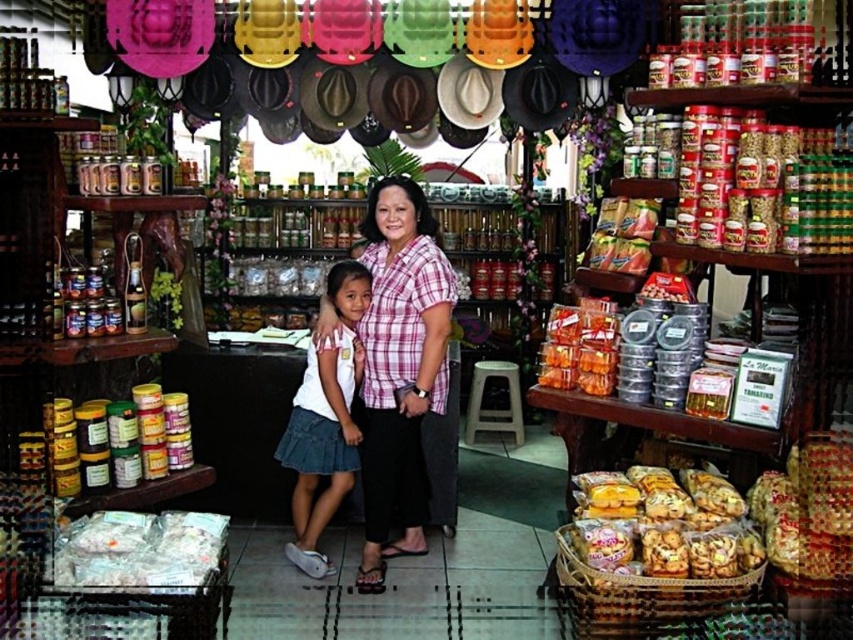
You are standing in the shop and want to reach both the point at coordinates (418, 317) and the point at coordinates (705, 516). Which point will require you to walk further back in the shop to reach?

The point at coordinates (705, 516) will require you to walk further back because it is positioned farther from the camera compared to the point at (418, 317), which is closer.